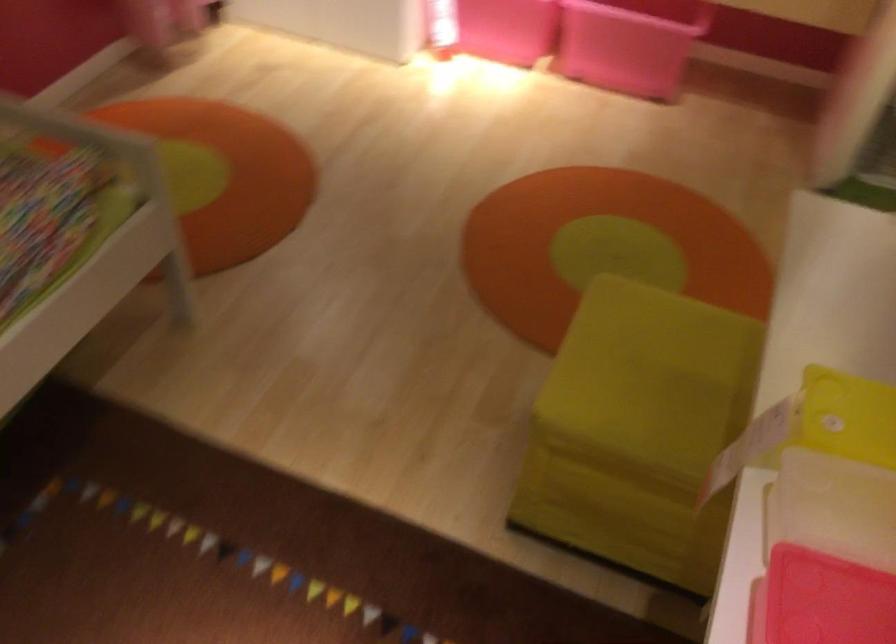
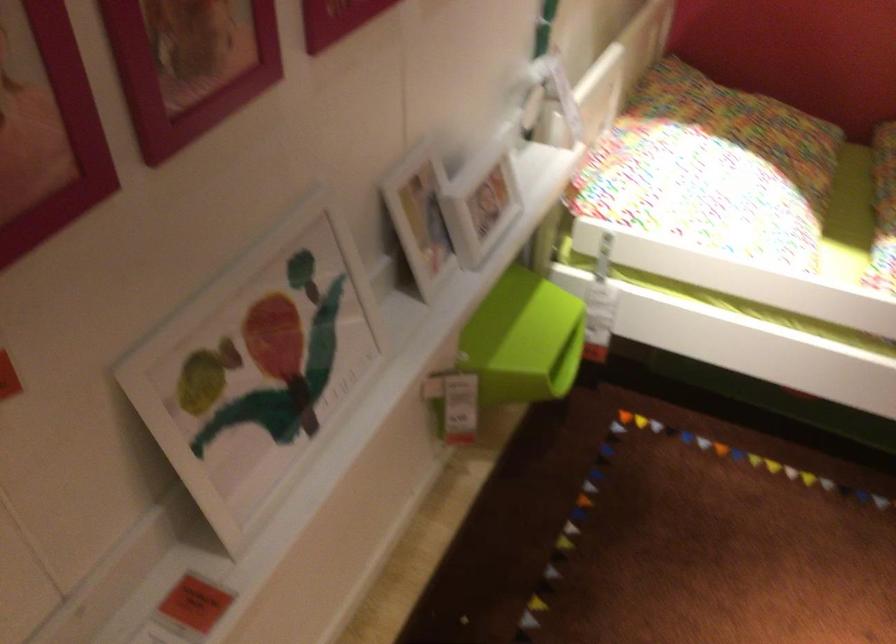
From the picture: The images are taken continuously from a first-person perspective. In which direction is your viewpoint rotating?

The camera's rotation is toward left-down.